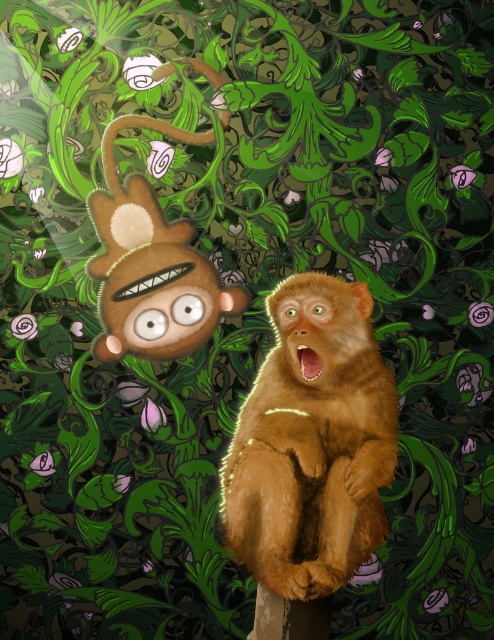
Who is shorter, fuzzy brown monkey at center or fuzzy brown plush at upper left?

fuzzy brown monkey at center is shorter.

At what (x,y) coordinates should I click in order to perform the action: click on fuzzy brown monkey at center. Please return your answer as a coordinate pair (x, y). This screenshot has width=494, height=640. Looking at the image, I should click on (313, 442).

Locate an element on the screen. The height and width of the screenshot is (640, 494). fuzzy brown monkey at center is located at coordinates (313, 442).